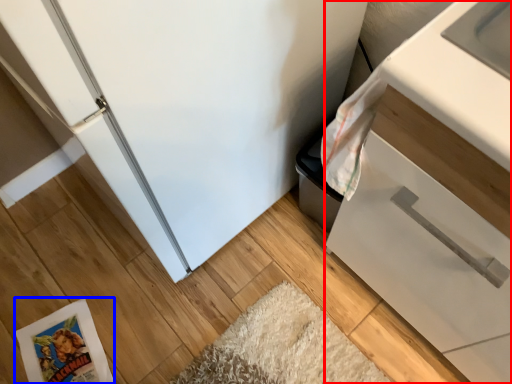
Question: Which object is further to the camera taking this photo, cabinetry (highlighted by a red box) or comic book (highlighted by a blue box)?

Choices:
 (A) cabinetry
 (B) comic book

Answer: (B)